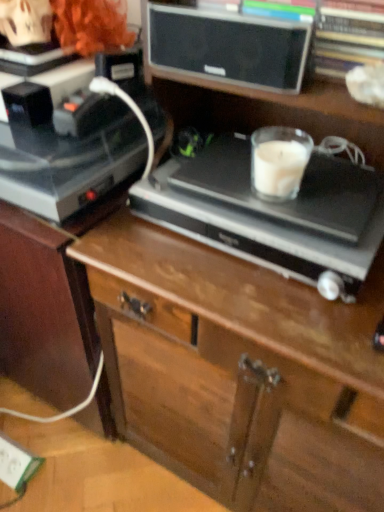
Question: Would you consider satin black record player at center, the first appliance positioned from the right, to be distant from white plastic electric outlet at lower left?

Choices:
 (A) no
 (B) yes

Answer: (A)

Question: From the image's perspective, is satin black record player at center, the first appliance positioned from the right, under white plastic electric outlet at lower left?

Choices:
 (A) no
 (B) yes

Answer: (A)

Question: Is white plastic electric outlet at lower left at the back of satin black record player at center, the first appliance positioned from the right?

Choices:
 (A) no
 (B) yes

Answer: (A)

Question: Is satin black record player at center, the first appliance positioned from the right, bigger than white plastic electric outlet at lower left?

Choices:
 (A) no
 (B) yes

Answer: (B)

Question: Does satin black record player at center, positioned as the second appliance in left-to-right order, have a smaller size compared to white plastic electric outlet at lower left?

Choices:
 (A) no
 (B) yes

Answer: (A)

Question: From a real-world perspective, is satin black record player at center, the first appliance positioned from the right, positioned above or below shiny black record player at left, which is the second appliance from right to left?

Choices:
 (A) below
 (B) above

Answer: (A)

Question: Considering the positions of satin black record player at center, positioned as the second appliance in left-to-right order, and shiny black record player at left, the 1th appliance viewed from the left, in the image, is satin black record player at center, positioned as the second appliance in left-to-right order, wider or thinner than shiny black record player at left, the 1th appliance viewed from the left,?

Choices:
 (A) thin
 (B) wide

Answer: (B)

Question: Relative to shiny black record player at left, the 1th appliance viewed from the left, is satin black record player at center, the first appliance positioned from the right, in front or behind?

Choices:
 (A) front
 (B) behind

Answer: (A)

Question: Is satin black record player at center, positioned as the second appliance in left-to-right order, inside or outside of shiny black record player at left, which is the second appliance from right to left?

Choices:
 (A) inside
 (B) outside

Answer: (B)

Question: Choose the correct answer: Is shiny black record player at left, the 1th appliance viewed from the left, inside satin black record player at center, the first appliance positioned from the right, or outside it?

Choices:
 (A) outside
 (B) inside

Answer: (A)

Question: In terms of height, does shiny black record player at left, which is the second appliance from right to left, look taller or shorter compared to satin black record player at center, positioned as the second appliance in left-to-right order?

Choices:
 (A) short
 (B) tall

Answer: (B)

Question: Is shiny black record player at left, the 1th appliance viewed from the left, in front of or behind satin black record player at center, positioned as the second appliance in left-to-right order, in the image?

Choices:
 (A) behind
 (B) front

Answer: (A)

Question: Is point (102, 114) positioned closer to the camera than point (370, 174)?

Choices:
 (A) farther
 (B) closer

Answer: (A)

Question: Is wooden chest of drawers at center wider or thinner than shiny black record player at left, the 1th appliance viewed from the left?

Choices:
 (A) thin
 (B) wide

Answer: (B)

Question: Considering the positions of point (296, 333) and point (99, 121), is point (296, 333) closer or farther from the camera than point (99, 121)?

Choices:
 (A) closer
 (B) farther

Answer: (A)